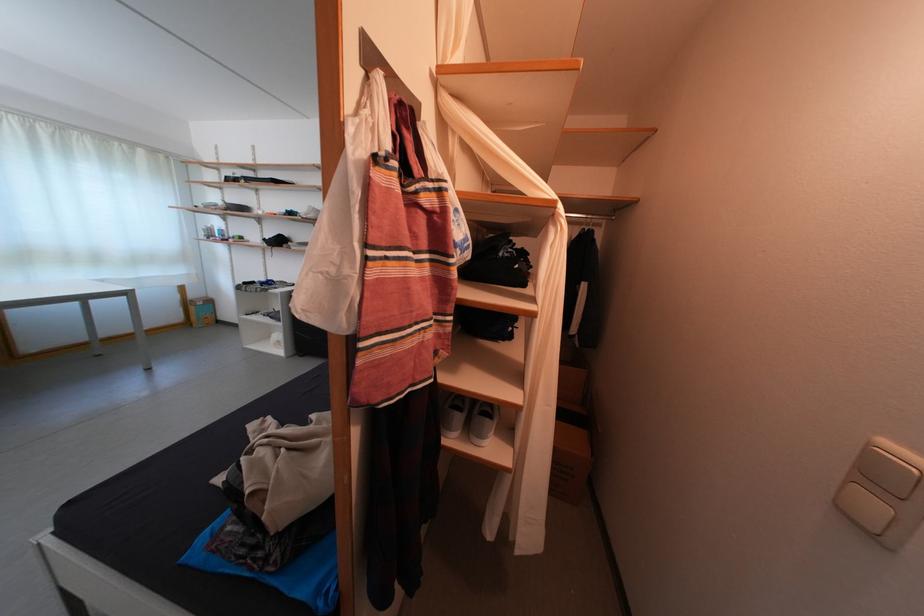
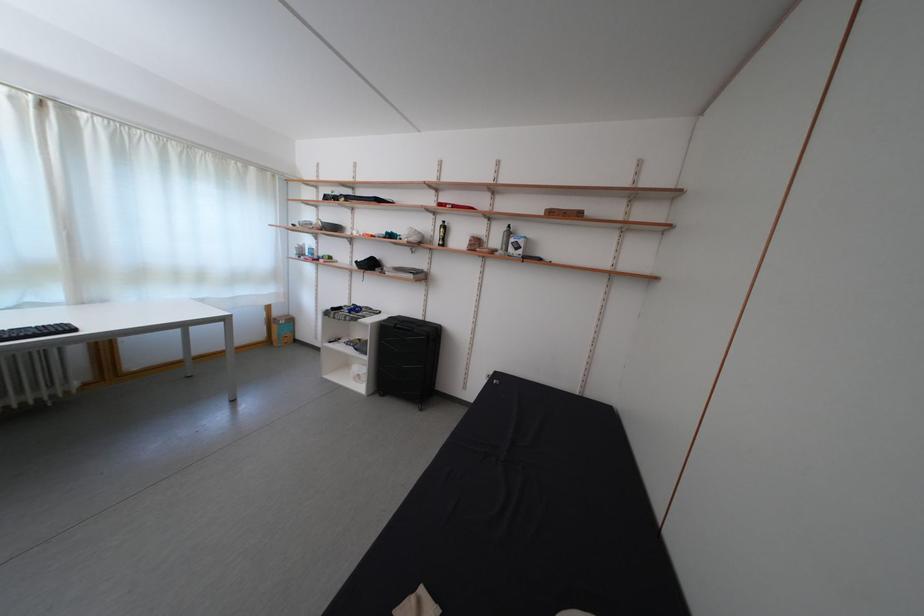
In the second image, find the point that corresponds to the point at 201,302 in the first image.

(285, 320)